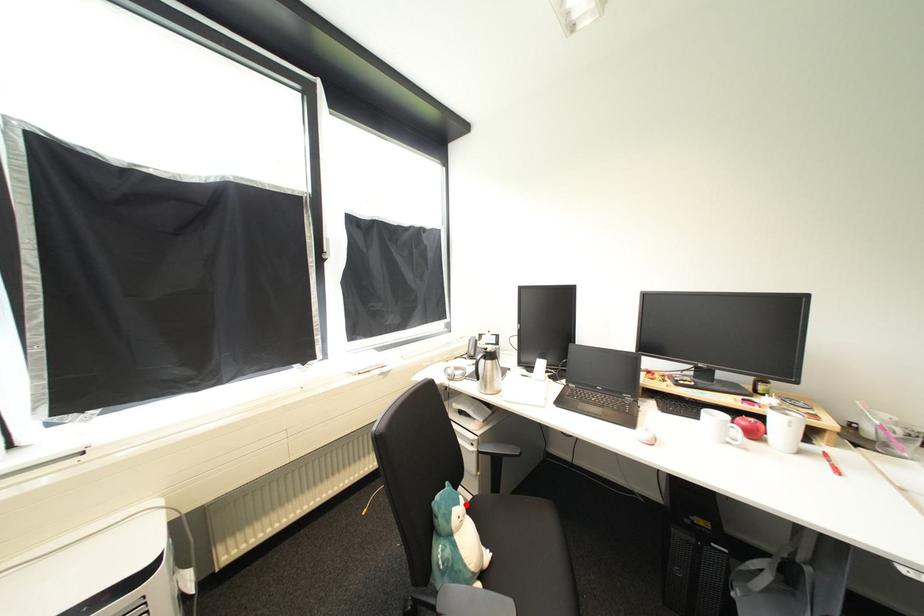
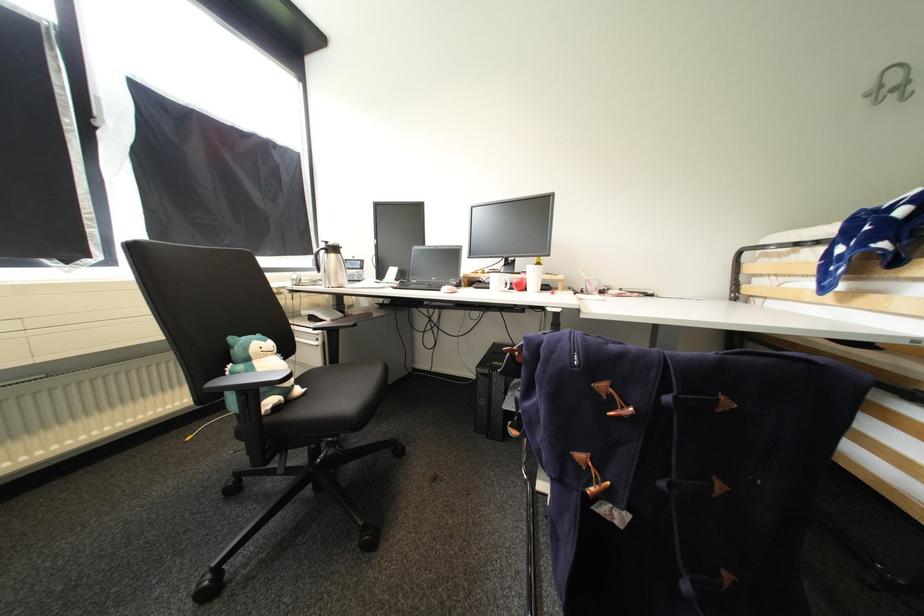
Question: A red point is marked in image1. In image2, is the corresponding 3D point closer to the camera or farther? Reply with the corresponding letter.

Choices:
 (A) The corresponding 3D point is closer.
 (B) The corresponding 3D point is farther.

Answer: (B)